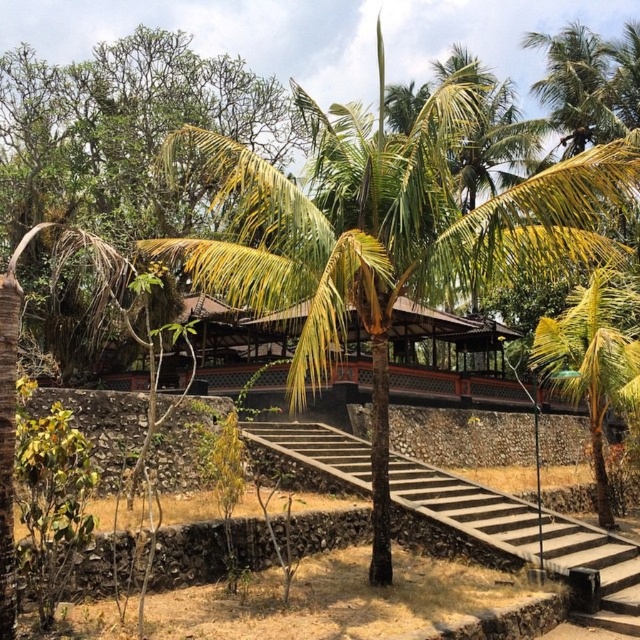
Does green leafy palm tree at center have a smaller size compared to brown wooden stairs at center?

No, green leafy palm tree at center is not smaller than brown wooden stairs at center.

Between green leafy palm tree at center and brown wooden stairs at center, which one is positioned lower?

Positioned lower is brown wooden stairs at center.

Does point (292, 353) come behind point (600, 564)?

Yes, it is.

Find the location of a particular element. green leafy palm tree at center is located at coordinates (387, 236).

Between brown wooden stairs at center and green leafy palm tree at right, which one has less height?

With less height is brown wooden stairs at center.

Is brown wooden stairs at center further to camera compared to green leafy palm tree at right?

No, it is in front of green leafy palm tree at right.

This screenshot has height=640, width=640. I want to click on brown wooden stairs at center, so click(x=524, y=532).

Can you confirm if green leafy palm tree at center is bigger than green leafy palm tree at right?

Correct, green leafy palm tree at center is larger in size than green leafy palm tree at right.

From the picture: Does green leafy palm tree at center have a greater height compared to green leafy palm tree at right?

Indeed, green leafy palm tree at center has a greater height compared to green leafy palm tree at right.

Is point (376, 570) positioned in front of point (618, 291)?

That is True.

Where is `green leafy palm tree at center`? green leafy palm tree at center is located at coordinates (387, 236).